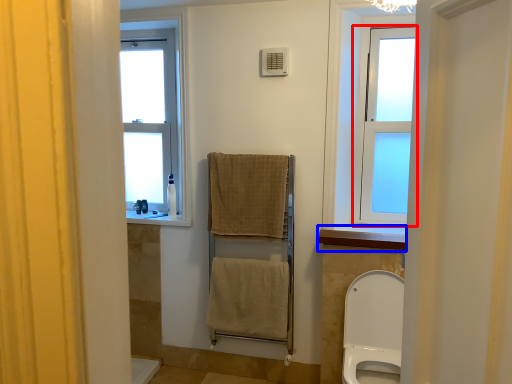
Question: Among these objects, which one is nearest to the camera, window (highlighted by a red box) or window sill (highlighted by a blue box)?

Choices:
 (A) window
 (B) window sill

Answer: (B)